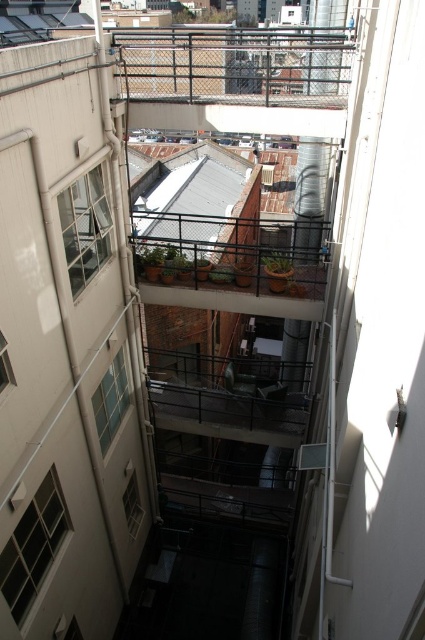
Question: Considering the real-world distances, which object is farthest from the metallic gray balcony at center?

Choices:
 (A) metal mesh balcony at center
 (B) black metal fence at upper center

Answer: (B)

Question: In this image, where is metal mesh balcony at center located relative to metallic gray balcony at center?

Choices:
 (A) right
 (B) left

Answer: (B)

Question: Which object appears farthest from the camera in this image?

Choices:
 (A) black metal fence at upper center
 (B) metal mesh balcony at center
 (C) metallic gray balcony at center

Answer: (C)

Question: Which point is farther to the camera?

Choices:
 (A) black metal fence at upper center
 (B) metallic gray balcony at center

Answer: (B)

Question: Does black metal fence at upper center appear on the left side of metallic gray balcony at center?

Choices:
 (A) yes
 (B) no

Answer: (B)

Question: Is black metal fence at upper center above metal mesh balcony at center?

Choices:
 (A) yes
 (B) no

Answer: (A)